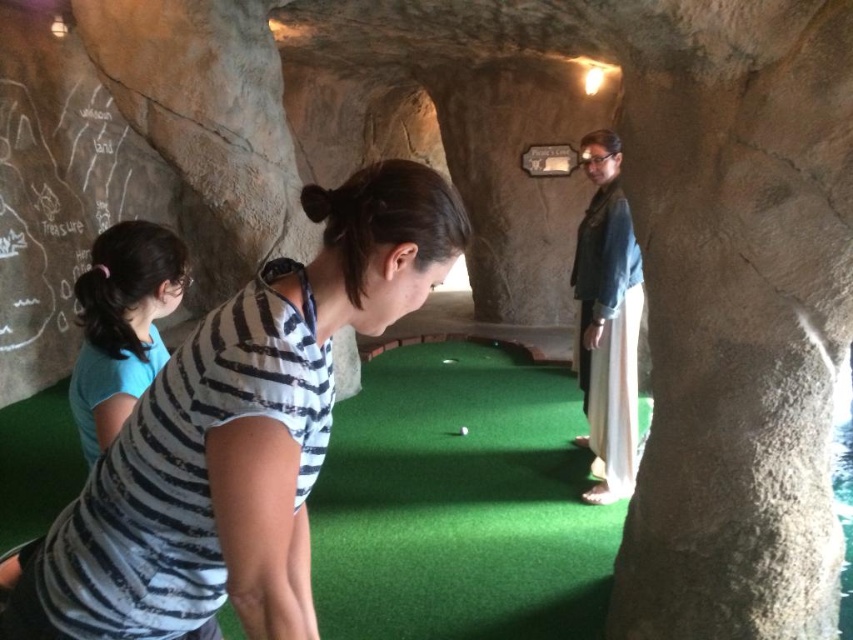
Question: Can you confirm if green artificial turf at center is bigger than denim jacket at right?

Choices:
 (A) yes
 (B) no

Answer: (A)

Question: Is denim jacket at right behind blue fabric shirt at left?

Choices:
 (A) yes
 (B) no

Answer: (A)

Question: Which point is closer to the camera?

Choices:
 (A) (630, 378)
 (B) (82, 406)
 (C) (509, 618)

Answer: (B)

Question: In this image, where is green artificial turf at center located relative to blue fabric shirt at left?

Choices:
 (A) right
 (B) left

Answer: (A)

Question: Which of these objects is positioned closest to the blue fabric shirt at left?

Choices:
 (A) striped fabric shirt at center
 (B) denim jacket at right

Answer: (A)

Question: Which point appears closest to the camera in this image?

Choices:
 (A) (625, 321)
 (B) (146, 268)
 (C) (252, 428)

Answer: (C)